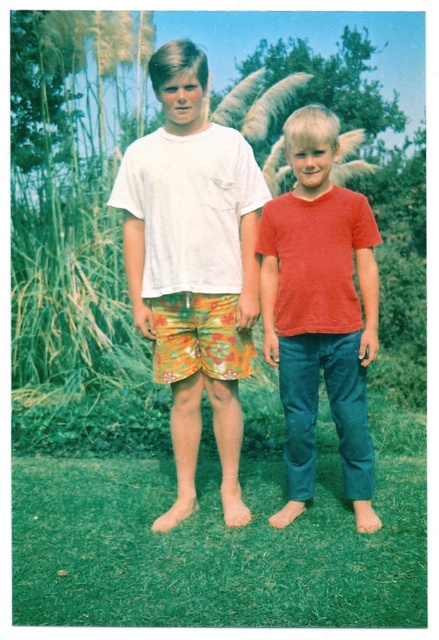
Who is positioned more to the left, floral cotton shorts at center or matte red t-shirt at center?

floral cotton shorts at center is more to the left.

Is floral cotton shorts at center positioned behind matte red t-shirt at center?

Yes, it is behind matte red t-shirt at center.

The height and width of the screenshot is (640, 439). What do you see at coordinates (194, 266) in the screenshot? I see `floral cotton shorts at center` at bounding box center [194, 266].

The width and height of the screenshot is (439, 640). What are the coordinates of `floral cotton shorts at center` in the screenshot? It's located at (194, 266).